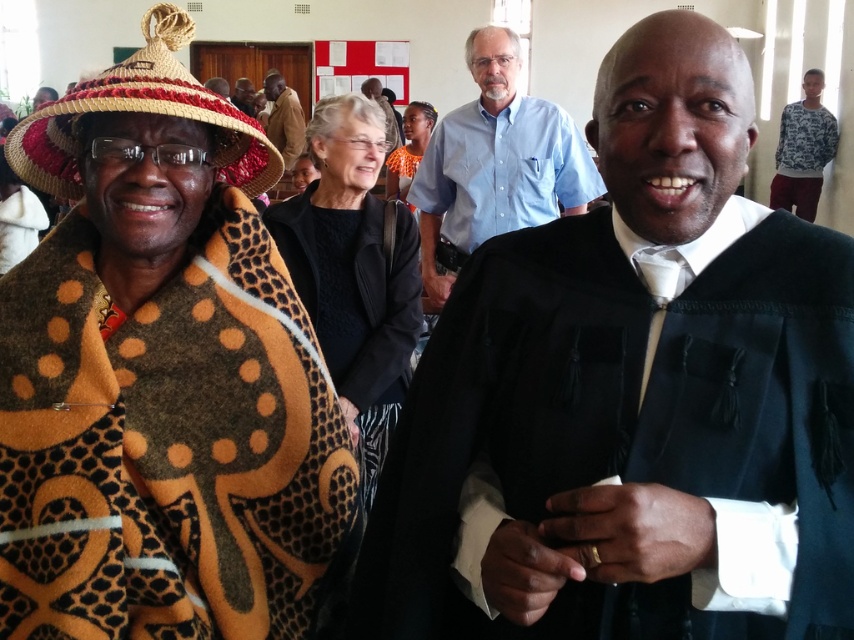
You are standing at the center of the image. Which direction should you move to get closer to the brown textured blanket at left?

Since the brown textured blanket at left is located at point 0.702 on the x axis and 0.198 on the y axis, you should move to the left to get closer to it.

You are organizing a photo shoot and need to arrange the light blue shirt at center and the matte black shirt at center in a way that the larger one is placed behind the smaller one for better visibility. Based on the image description, which shirt should be positioned behind the other?

The light blue shirt at center is larger in size than the matte black shirt at center, so it should be placed behind the matte black shirt at center to ensure the smaller one remains visible.